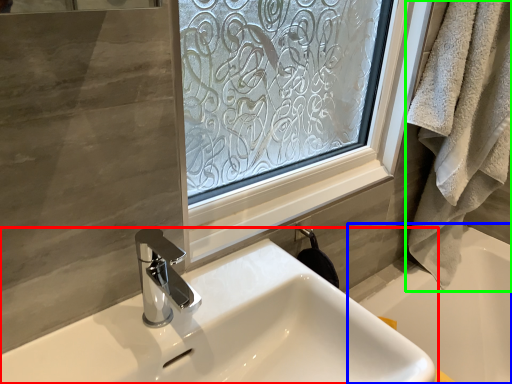
Question: Which object is positioned closest to sink (highlighted by a red box)? Select from bath (highlighted by a blue box) and bath towel (highlighted by a green box).

Choices:
 (A) bath
 (B) bath towel

Answer: (B)